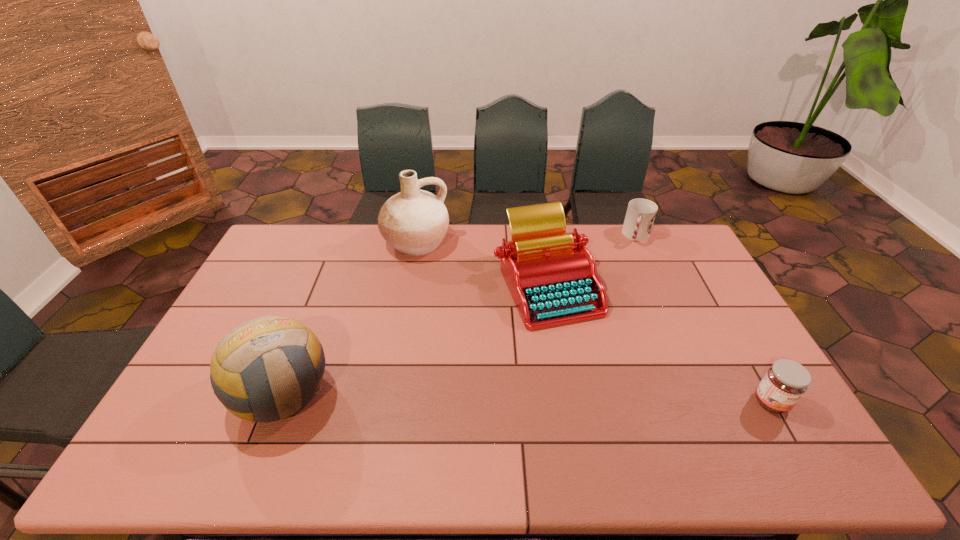
Where is `vacant space at the far edge of the desktop`? This screenshot has height=540, width=960. vacant space at the far edge of the desktop is located at coordinates (569, 226).

The height and width of the screenshot is (540, 960). In the image, there is a desktop. What are the coordinates of `vacant region at the near edge` in the screenshot? It's located at (318, 421).

Locate an element on the screen. The width and height of the screenshot is (960, 540). free spot at the left edge of the desktop is located at coordinates (261, 273).

The image size is (960, 540). Find the location of `blank space at the right edge`. blank space at the right edge is located at coordinates (693, 321).

In the image, there is a desktop. Find the location of `free region at the far left corner`. free region at the far left corner is located at coordinates (310, 230).

Image resolution: width=960 pixels, height=540 pixels. In order to click on vacant space at the far right corner in this screenshot , I will do `click(661, 230)`.

You are a GUI agent. You are given a task and a screenshot of the screen. Output one action in this format:
    pyautogui.click(x=<x>, y=<y>)
    Task: Click on the unoccupied area between the third object from right to left and the rightmost object
    
    Given the screenshot: What is the action you would take?
    pyautogui.click(x=659, y=343)

Identify the location of free space between the fourth object from left to right and the rightmost object. (704, 319).

Identify the location of vacant point located between the second tallest object and the rightmost object. Image resolution: width=960 pixels, height=540 pixels. [527, 398].

Find the location of `vacant area that lies between the typewriter and the rightmost object`. vacant area that lies between the typewriter and the rightmost object is located at coordinates (659, 343).